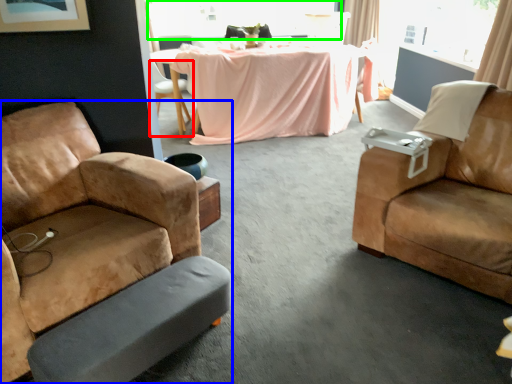
Question: Which object is the farthest from chair (highlighted by a red box)? Choose among these: chair (highlighted by a blue box) or window (highlighted by a green box).

Choices:
 (A) chair
 (B) window

Answer: (A)